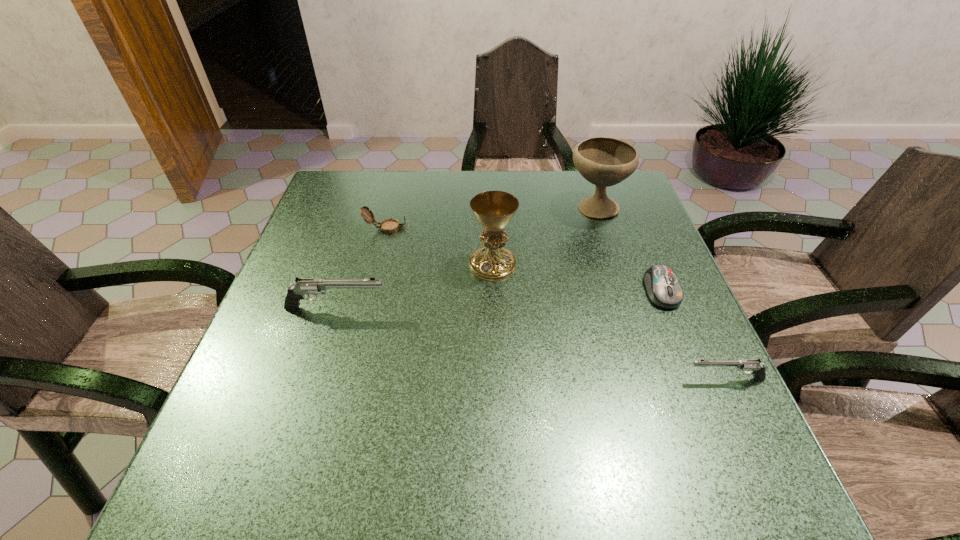
Where is `free space that satisfies the following two spatial constraints: 1. on the wheel side of the shortest object; 2. on the front-facing side of the left pistol`? This screenshot has height=540, width=960. free space that satisfies the following two spatial constraints: 1. on the wheel side of the shortest object; 2. on the front-facing side of the left pistol is located at coordinates (668, 308).

The height and width of the screenshot is (540, 960). I want to click on vacant region that satisfies the following two spatial constraints: 1. on the wheel side of the computer mouse; 2. on the front-facing side of the left pistol, so click(x=668, y=308).

This screenshot has height=540, width=960. Find the location of `blank space that satisfies the following two spatial constraints: 1. on the front side of the farther chalice; 2. on the front-facing side of the taller pistol`. blank space that satisfies the following two spatial constraints: 1. on the front side of the farther chalice; 2. on the front-facing side of the taller pistol is located at coordinates (627, 308).